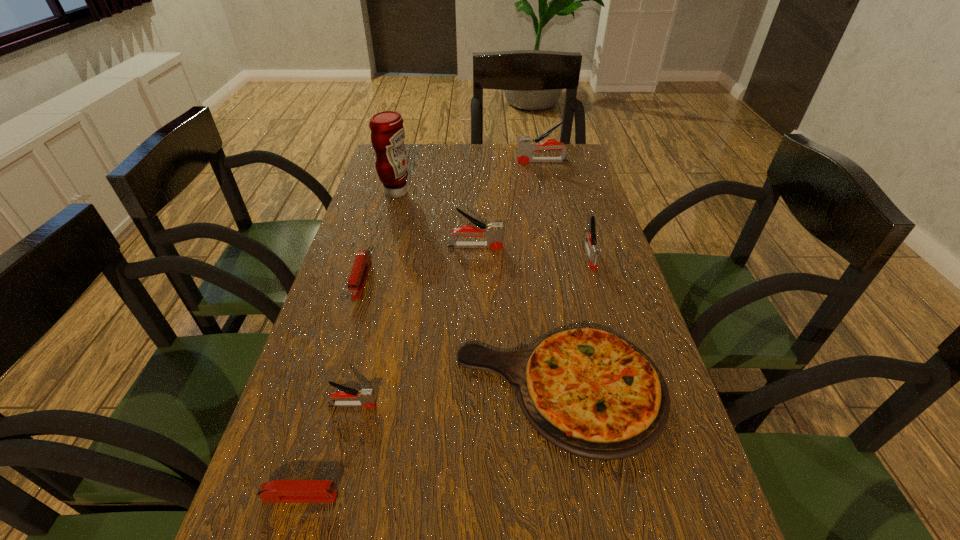
At what (x,y) coordinates should I click in order to perform the action: click on vacant region located on the handle side of the fourth shortest stapler. Please return your answer as a coordinate pair (x, y). Looking at the image, I should click on (617, 349).

The height and width of the screenshot is (540, 960). I want to click on vacant space located 0.240m on the handle side of the smallest gray stapler, so click(x=500, y=405).

This screenshot has height=540, width=960. I want to click on vacant region located 0.270m on the front-facing side of the farther red stapler, so click(x=326, y=397).

Locate an element on the screen. vacant area located 0.190m on the back of the pizza is located at coordinates (542, 274).

The width and height of the screenshot is (960, 540). I want to click on free space located on the front-facing side of the nearer red stapler, so click(545, 496).

You are a GUI agent. You are given a task and a screenshot of the screen. Output one action in this format:
    pyautogui.click(x=<x>, y=<y>)
    Task: Click on the object located in the far edge section of the desktop
    The width and height of the screenshot is (960, 540).
    Given the screenshot: What is the action you would take?
    pyautogui.click(x=526, y=146)

The height and width of the screenshot is (540, 960). Find the location of `condiment that is positioned at the left edge`. condiment that is positioned at the left edge is located at coordinates (387, 132).

Find the location of a particular element. The width and height of the screenshot is (960, 540). pizza that is at the right edge is located at coordinates (593, 394).

Identify the location of object that is positioned at the far right corner. The height and width of the screenshot is (540, 960). (526, 146).

Locate an element on the screen. The height and width of the screenshot is (540, 960). blank area at the far edge is located at coordinates (463, 163).